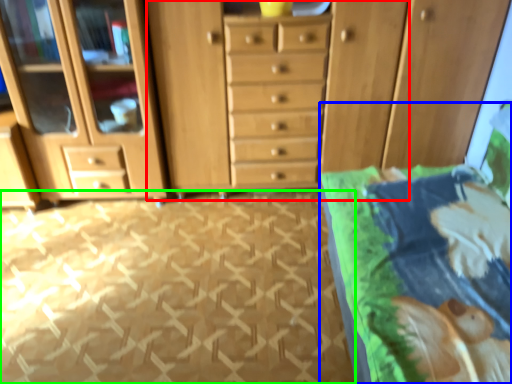
Question: Based on their relative distances, which object is nearer to dresser (highlighted by a red box)? Choose from bed (highlighted by a blue box) and tile (highlighted by a green box).

Choices:
 (A) bed
 (B) tile

Answer: (B)